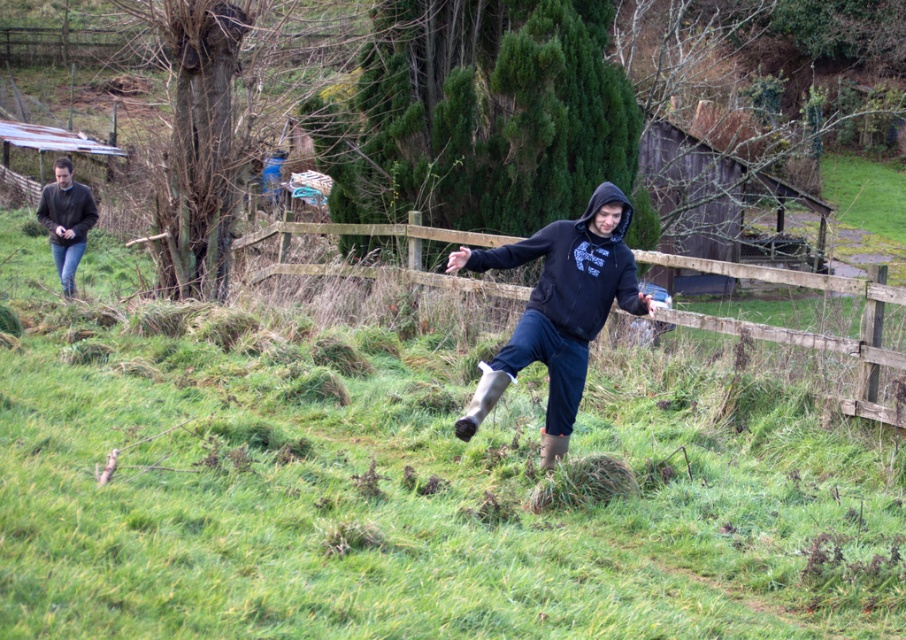
Question: Which object appears closest to the camera in this image?

Choices:
 (A) black matte hoodie at center
 (B) green grassy at center
 (C) dark gray jacket at left
 (D) black hoodie at center

Answer: (A)

Question: Is black hoodie at center further to the viewer compared to dark gray hoodie at left?

Choices:
 (A) yes
 (B) no

Answer: (B)

Question: Which point is closer to the camera?

Choices:
 (A) (72, 288)
 (B) (94, 621)

Answer: (B)

Question: Is black matte hoodie at center above black hoodie at center?

Choices:
 (A) yes
 (B) no

Answer: (B)

Question: Which of the following is the closest to the observer?

Choices:
 (A) green grassy at center
 (B) black hoodie at center
 (C) black matte hoodie at center
 (D) dark gray jacket at left

Answer: (C)

Question: Is green grassy at center positioned behind dark gray jacket at left?

Choices:
 (A) yes
 (B) no

Answer: (B)